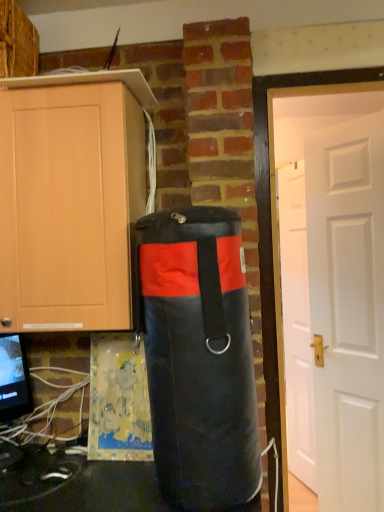
Question: Considering the relative positions of black fabric punching bag at center and white matte door at right, the first door when ordered from back to front, in the image provided, is black fabric punching bag at center to the left of white matte door at right, the first door when ordered from back to front, from the viewer's perspective?

Choices:
 (A) yes
 (B) no

Answer: (A)

Question: Is black fabric punching bag at center aimed at white matte door at right, the first door when ordered from back to front?

Choices:
 (A) no
 (B) yes

Answer: (A)

Question: Could white matte door at right, acting as the 2th door starting from the front, be considered to be inside black fabric punching bag at center?

Choices:
 (A) yes
 (B) no

Answer: (B)

Question: Considering the relative positions of black fabric punching bag at center and white matte door at right, the first door when ordered from back to front, in the image provided, is black fabric punching bag at center in front of white matte door at right, the first door when ordered from back to front,?

Choices:
 (A) no
 (B) yes

Answer: (B)

Question: From a real-world perspective, is black fabric punching bag at center over white matte door at right, the first door when ordered from back to front?

Choices:
 (A) yes
 (B) no

Answer: (A)

Question: Relative to white matte door at right, the first door when ordered from back to front, is matte wood cabinet at left in front or behind?

Choices:
 (A) front
 (B) behind

Answer: (A)

Question: Looking at their shapes, would you say matte wood cabinet at left is wider or thinner than white matte door at right, the first door when ordered from back to front?

Choices:
 (A) wide
 (B) thin

Answer: (A)

Question: From the image's perspective, relative to white matte door at right, acting as the 2th door starting from the front, is matte wood cabinet at left above or below?

Choices:
 (A) below
 (B) above

Answer: (B)

Question: In terms of size, does matte wood cabinet at left appear bigger or smaller than white matte door at right, the first door when ordered from back to front?

Choices:
 (A) small
 (B) big

Answer: (B)

Question: Considering the relative positions of black fabric punching bag at center and white matte door at right, the second door viewed from the back, in the image provided, is black fabric punching bag at center to the left or to the right of white matte door at right, the second door viewed from the back,?

Choices:
 (A) left
 (B) right

Answer: (A)

Question: Considering the positions of black fabric punching bag at center and white matte door at right, the 1th door when ordered from front to back, in the image, is black fabric punching bag at center bigger or smaller than white matte door at right, the 1th door when ordered from front to back,?

Choices:
 (A) small
 (B) big

Answer: (A)

Question: From the image's perspective, is black fabric punching bag at center above or below white matte door at right, the 1th door when ordered from front to back?

Choices:
 (A) above
 (B) below

Answer: (A)

Question: Is black fabric punching bag at center spatially inside white matte door at right, the 1th door when ordered from front to back, or outside of it?

Choices:
 (A) outside
 (B) inside

Answer: (A)

Question: Is matte black monitor at lower left wider or thinner than matte wood cabinet at left?

Choices:
 (A) wide
 (B) thin

Answer: (B)

Question: From the image's perspective, is matte black monitor at lower left located above or below matte wood cabinet at left?

Choices:
 (A) above
 (B) below

Answer: (B)